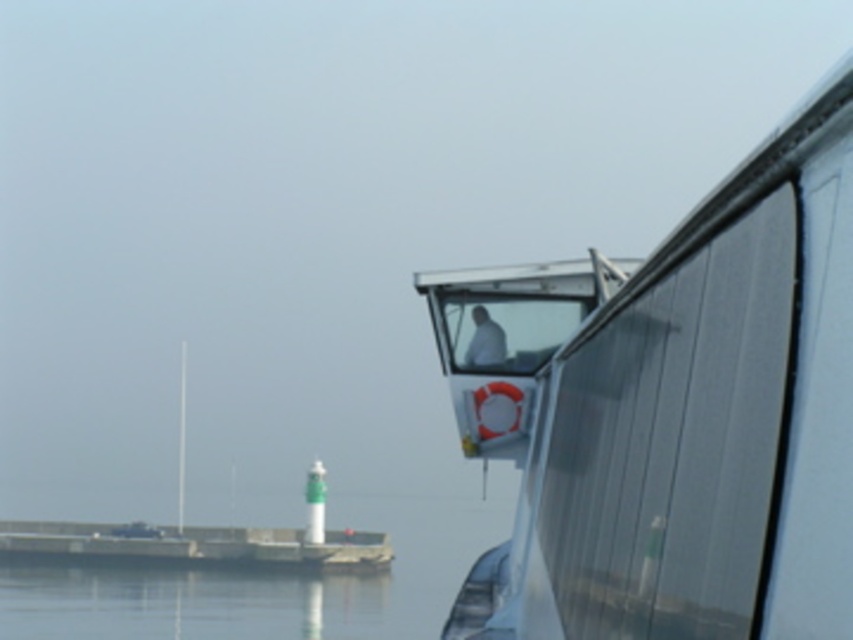
Between white glossy boat at upper center and concrete dock at lower left, which one appears on the left side from the viewer's perspective?

From the viewer's perspective, concrete dock at lower left appears more on the left side.

Is white glossy boat at upper center further to the viewer compared to concrete dock at lower left?

No, it is not.

Is point (708, 417) positioned before point (53, 532)?

That is True.

The width and height of the screenshot is (853, 640). In order to click on white glossy boat at upper center in this screenshot , I will do `click(672, 412)`.

Find the location of a particular element. The image size is (853, 640). white glossy boat at upper center is located at coordinates (672, 412).

At what (x,y) coordinates should I click in order to perform the action: click on white glossy boat at upper center. Please return your answer as a coordinate pair (x, y). Looking at the image, I should click on (672, 412).

Locate an element on the screen. This screenshot has height=640, width=853. white glossy boat at upper center is located at coordinates (672, 412).

Is point (56, 586) less distant than point (64, 536)?

Yes, it is.

Between transparent water at lower left and concrete dock at lower left, which one is positioned higher?

transparent water at lower left is higher up.

You are a GUI agent. You are given a task and a screenshot of the screen. Output one action in this format:
    pyautogui.click(x=<x>, y=<y>)
    Task: Click on the transparent water at lower left
    
    Given the screenshot: What is the action you would take?
    pyautogui.click(x=265, y=582)

The height and width of the screenshot is (640, 853). What are the coordinates of `transparent water at lower left` in the screenshot? It's located at (265, 582).